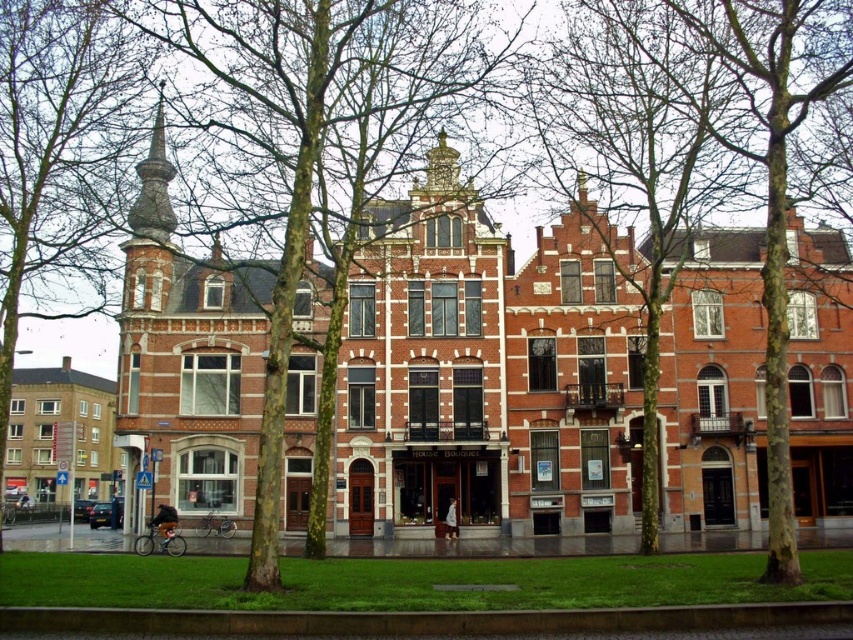
You are a bird flying over the scene. You want to land on the nearest tree to the green leafy tree at center. Which tree would you choose?

The nearest tree to the green leafy tree at center is the one that is 57.79 meters away. However, since all trees in the scene are leafless except the green leafy tree at center, there might be no other trees with leaves to land on. Please check the surroundings for other suitable landing spots.